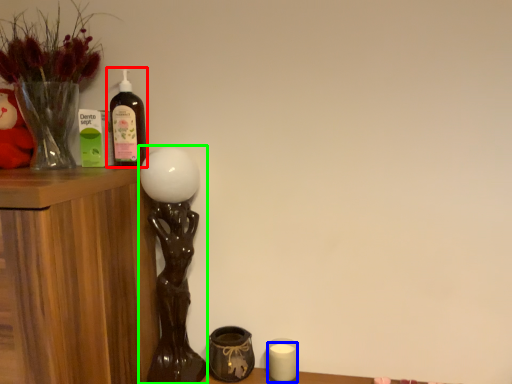
Question: Considering the real-world distances, which object is farthest from bottle (highlighted by a red box)? candle (highlighted by a blue box) or table lamp (highlighted by a green box)?

Choices:
 (A) candle
 (B) table lamp

Answer: (A)